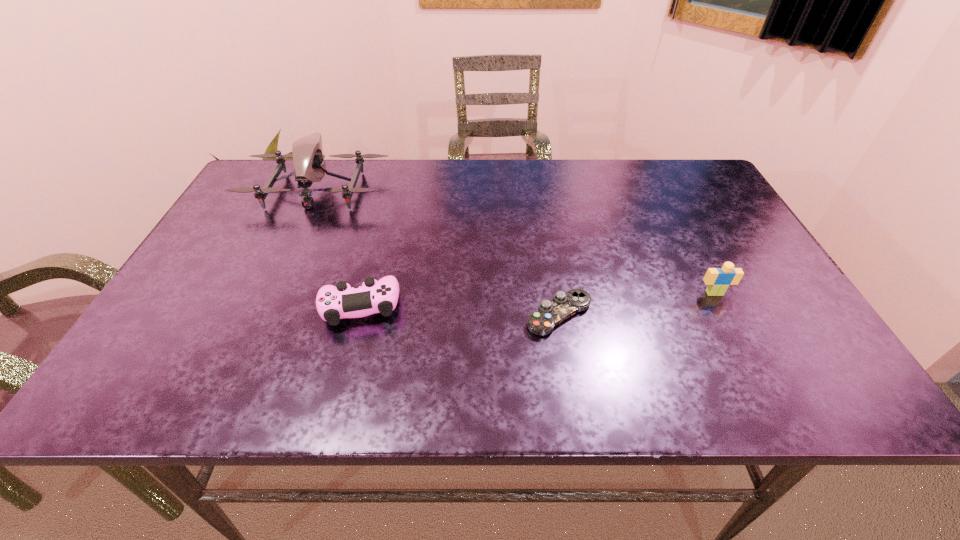
The width and height of the screenshot is (960, 540). I want to click on free space that satisfies the following two spatial constraints: 1. on the front side of the third object from left to right; 2. on the left side of the taller control, so click(358, 315).